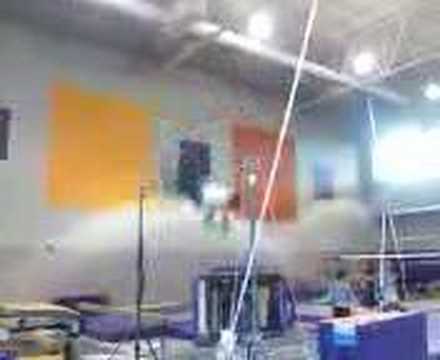
Locate an element on the screen. The height and width of the screenshot is (360, 440). light blue wall covering is located at coordinates (323, 187).